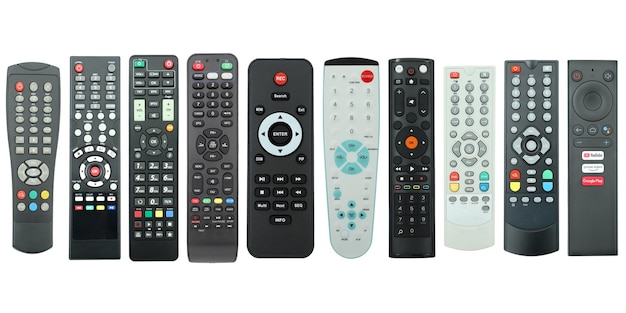
Locate an element on the screen. This screenshot has width=626, height=313. remote controls is located at coordinates (26, 128), (98, 136), (160, 155), (218, 165), (285, 170), (350, 144), (418, 111), (478, 124), (531, 139), (592, 165).